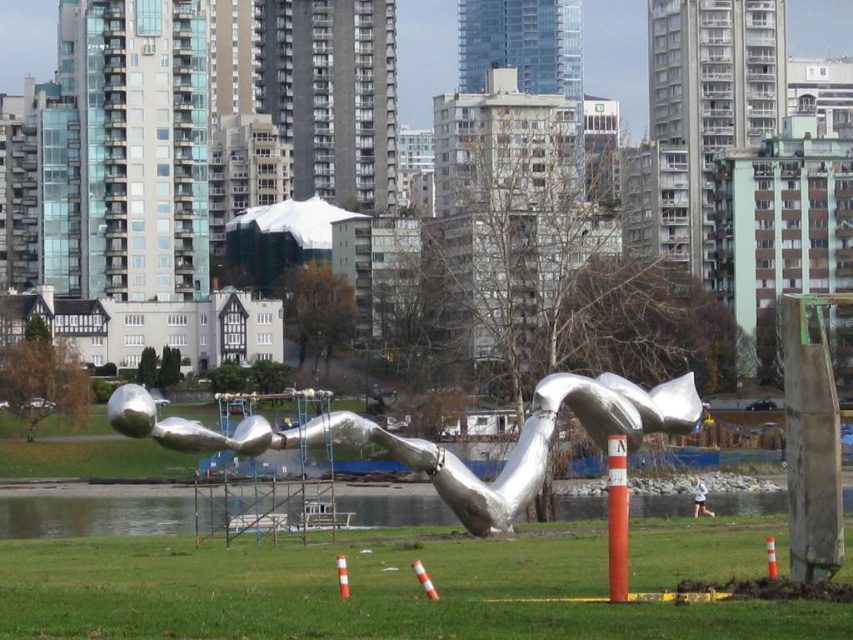
Looking at this image, you are a city planner evaluating the park layout. You need to place a new bench exactly between the silver metallic sculpture at center and the orange striped traffic cone at center. Which object will the bench be closer to?

The bench will be closer to the orange striped traffic cone at center because the silver metallic sculpture at center is larger in size than the orange striped traffic cone at center, meaning the distance between them is measured from their centers. Since the sculpture is larger, the midpoint would be nearer to the smaller cone.

You are a city planner assessing the park layout. The silver metallic sculpture at center and the orange striped traffic cone at center are both in the central area. Which object is taller?

The silver metallic sculpture at center is taller than the orange striped traffic cone at center.